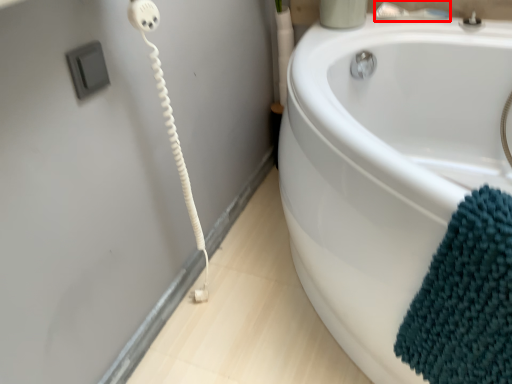
Question: Observing the image, what is the correct spatial positioning of faucet (annotated by the red box) in reference to bath towel?

Choices:
 (A) right
 (B) left

Answer: (A)